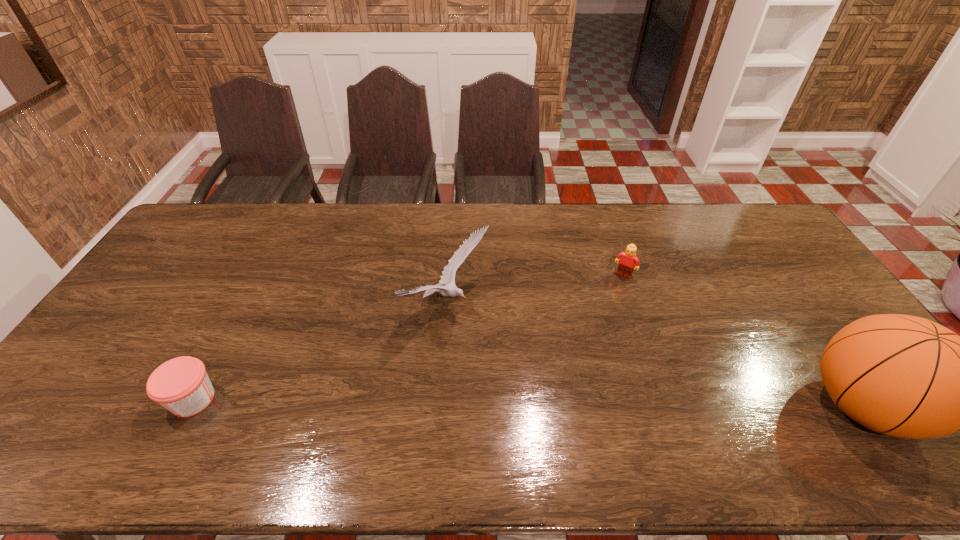
You are a GUI agent. You are given a task and a screenshot of the screen. Output one action in this format:
    pyautogui.click(x=<x>, y=<y>)
    Task: Click on the empty space that is in between the second shortest object and the second object from left to right
    The width and height of the screenshot is (960, 540).
    Given the screenshot: What is the action you would take?
    pyautogui.click(x=536, y=291)

This screenshot has width=960, height=540. Find the location of `unoccupied position between the shortest object and the gull`. unoccupied position between the shortest object and the gull is located at coordinates (321, 353).

I want to click on unoccupied position between the third object from left to right and the leftmost object, so click(x=408, y=337).

This screenshot has width=960, height=540. Find the location of `free point between the jam and the third tallest object`. free point between the jam and the third tallest object is located at coordinates (408, 337).

The height and width of the screenshot is (540, 960). I want to click on empty location between the gull and the rightmost object, so click(x=655, y=356).

Identify the location of the second closest object to the shortest object. (627, 263).

Locate an element on the screen. object that stands as the third closest to the gull is located at coordinates (905, 376).

This screenshot has width=960, height=540. Identify the location of blank area in the image that satisfies the following two spatial constraints: 1. on the back side of the Lego; 2. on the right side of the gull. (449, 275).

Locate an element on the screen. This screenshot has height=540, width=960. vacant area in the image that satisfies the following two spatial constraints: 1. on the back side of the second tallest object; 2. on the right side of the Lego is located at coordinates (449, 275).